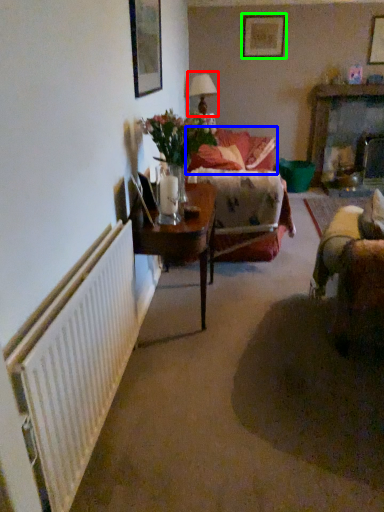
Question: Which is nearer to the table lamp (highlighted by a red box)? couch (highlighted by a blue box) or picture frame (highlighted by a green box).

Choices:
 (A) couch
 (B) picture frame

Answer: (B)